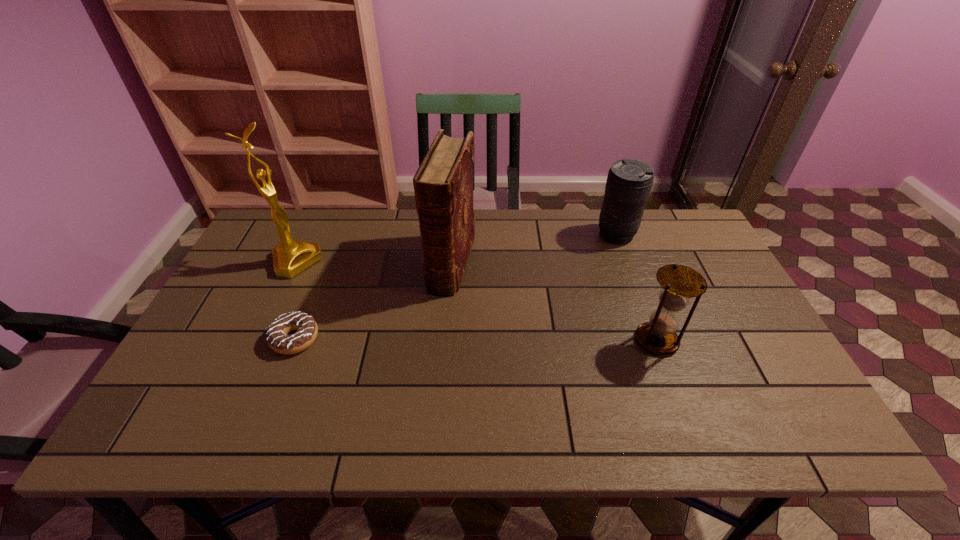
Identify the location of the shortest object. (277, 338).

This screenshot has height=540, width=960. What are the coordinates of `hourglass` in the screenshot? It's located at (x=679, y=283).

Identify the location of hardback book. (443, 185).

Image resolution: width=960 pixels, height=540 pixels. Identify the location of the second tallest object. (443, 185).

The width and height of the screenshot is (960, 540). Identify the location of telephoto lens. (629, 181).

At what (x,y) coordinates should I click in order to perform the action: click on award. Please return your answer as a coordinate pair (x, y). The image size is (960, 540). Looking at the image, I should click on (290, 257).

Image resolution: width=960 pixels, height=540 pixels. I want to click on blank space located 0.050m on the back of the doughnut, so click(307, 307).

You are a GUI agent. You are given a task and a screenshot of the screen. Output one action in this format:
    pyautogui.click(x=<x>, y=<y>)
    Task: Click on the vacant space situated on the left of the hourglass
    The height and width of the screenshot is (540, 960).
    Given the screenshot: What is the action you would take?
    pyautogui.click(x=500, y=340)

At what (x,y) coordinates should I click in order to perform the action: click on free spot located on the spine side of the third object from right to left. Please return your answer as a coordinate pair (x, y). Looking at the image, I should click on (429, 345).

I want to click on free region located on the spine side of the third object from right to left, so click(x=412, y=396).